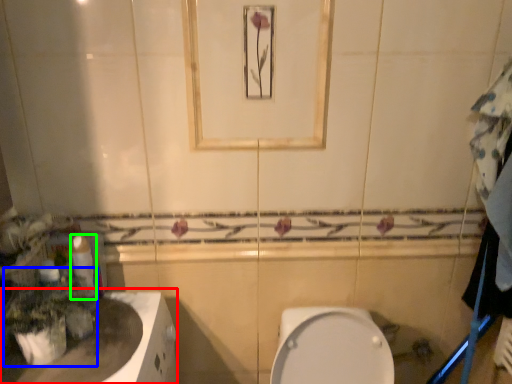
Question: Which object is positioned closest to counter top (highlighted by a red box)? Select from plant (highlighted by a blue box) and toilet paper (highlighted by a green box).

Choices:
 (A) plant
 (B) toilet paper

Answer: (A)